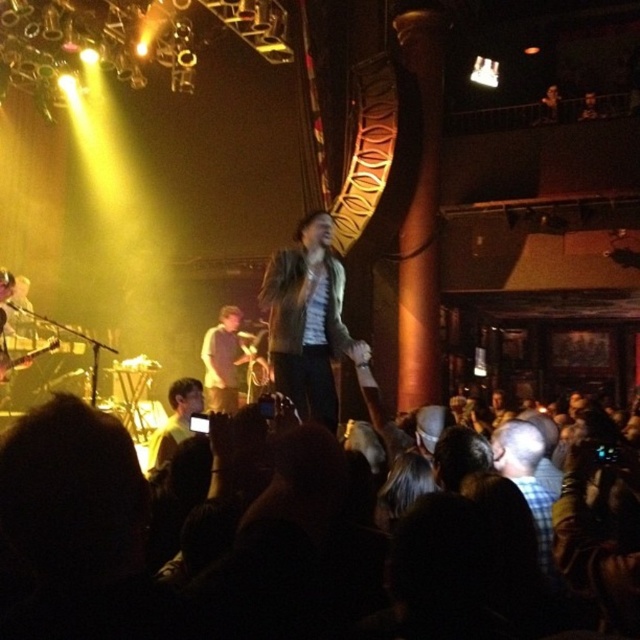
Question: Considering the relative positions of leather jacket at center and dark brown leather jacket at lower left in the image provided, where is leather jacket at center located with respect to dark brown leather jacket at lower left?

Choices:
 (A) above
 (B) below

Answer: (A)

Question: Can you confirm if leather jacket at center is smaller than dark brown leather jacket at lower left?

Choices:
 (A) yes
 (B) no

Answer: (B)

Question: Can you confirm if leather jacket at center is smaller than dark brown leather jacket at lower left?

Choices:
 (A) no
 (B) yes

Answer: (A)

Question: Among these points, which one is farthest from the camera?

Choices:
 (A) (180, 435)
 (B) (276, 381)

Answer: (A)